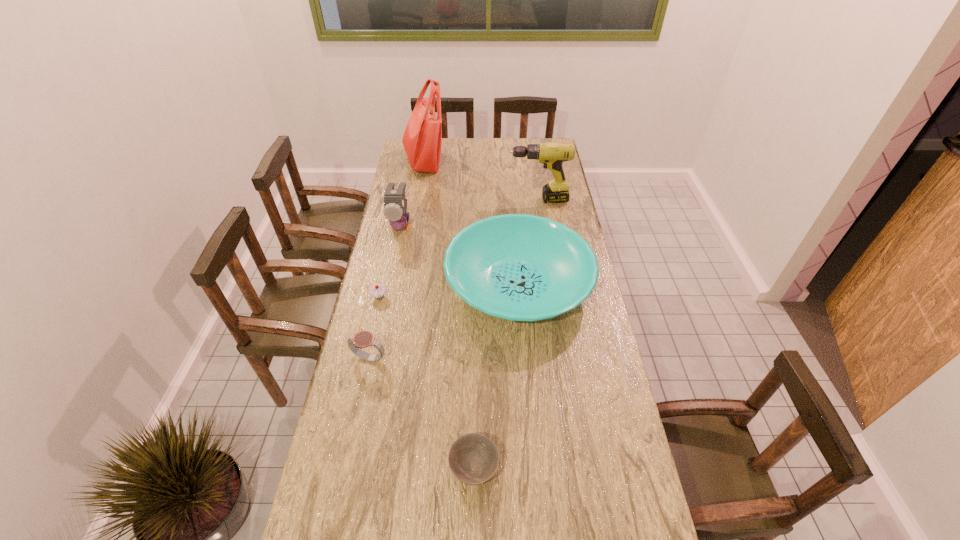
Image resolution: width=960 pixels, height=540 pixels. In order to click on the farthest object in this screenshot , I will do `click(422, 139)`.

You are a GUI agent. You are given a task and a screenshot of the screen. Output one action in this format:
    pyautogui.click(x=<x>, y=<y>)
    Task: Click on the handbag
    The width and height of the screenshot is (960, 540).
    Given the screenshot: What is the action you would take?
    pyautogui.click(x=422, y=139)

You are a GUI agent. You are given a task and a screenshot of the screen. Output one action in this format:
    pyautogui.click(x=<x>, y=<y>)
    Task: Click on the second farthest object
    
    Given the screenshot: What is the action you would take?
    pyautogui.click(x=552, y=154)

At what (x,y) coordinates should I click in order to perform the action: click on drill. Please return your answer as a coordinate pair (x, y). The image size is (960, 540). Looking at the image, I should click on (552, 154).

In order to click on bird in this screenshot , I will do `click(395, 203)`.

Where is `the fourth tallest object`? This screenshot has width=960, height=540. the fourth tallest object is located at coordinates (519, 267).

Identify the location of the sixth farthest object. click(363, 339).

Where is `cupcake`? Image resolution: width=960 pixels, height=540 pixels. cupcake is located at coordinates (377, 291).

Identify the location of the shortest object. Image resolution: width=960 pixels, height=540 pixels. (473, 458).

The image size is (960, 540). I want to click on the nearest object, so click(473, 458).